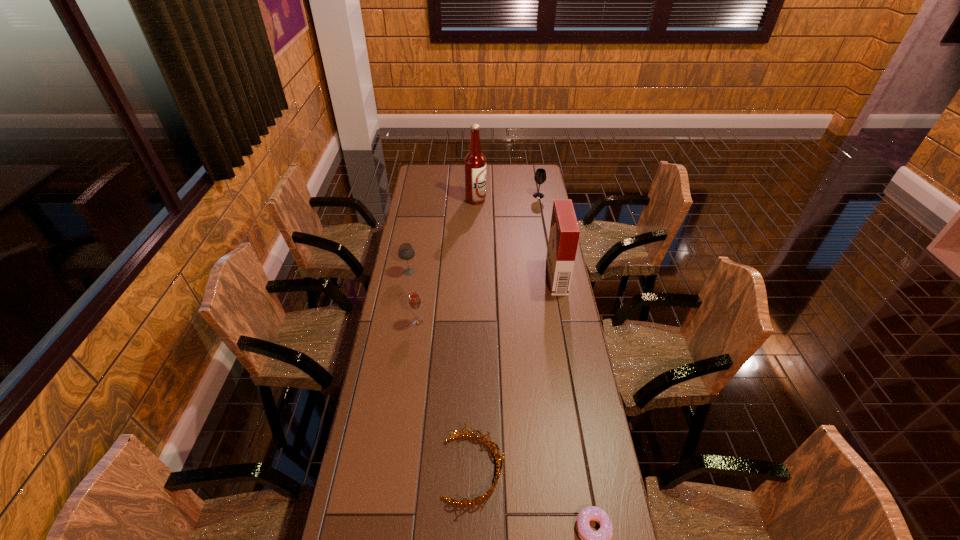
You are a GUI agent. You are given a task and a screenshot of the screen. Output one action in this format:
    pyautogui.click(x=<x>, y=<y>)
    Task: Click on the vacant space at the left edge of the desktop
    The image size is (960, 540).
    Given the screenshot: What is the action you would take?
    pyautogui.click(x=384, y=345)

The image size is (960, 540). In the image, there is a desktop. What are the coordinates of `vacant space at the right edge` in the screenshot? It's located at (574, 314).

You are a GUI agent. You are given a task and a screenshot of the screen. Output one action in this format:
    pyautogui.click(x=<x>, y=<y>)
    Task: Click on the vacant point at the far left corner
    
    Given the screenshot: What is the action you would take?
    pyautogui.click(x=425, y=168)

The height and width of the screenshot is (540, 960). Find the location of `vacant area that lies between the tiara and the second wineglass from right to left`. vacant area that lies between the tiara and the second wineglass from right to left is located at coordinates (445, 395).

Locate an element on the screen. blank region between the nearest wineglass and the tallest object is located at coordinates (446, 260).

The image size is (960, 540). I want to click on free space between the second nearest object and the alcohol, so click(474, 334).

Where is `free space that is in between the tallest object and the farthest wineglass`? The image size is (960, 540). free space that is in between the tallest object and the farthest wineglass is located at coordinates (507, 198).

I want to click on vacant space that's between the rightmost wineglass and the second farthest wineglass, so click(x=474, y=234).

In order to click on free area in between the alcohol and the tiara in this screenshot , I will do (x=474, y=334).

Locate an element on the screen. This screenshot has height=540, width=960. blank region between the rightmost wineglass and the leftmost object is located at coordinates (474, 234).